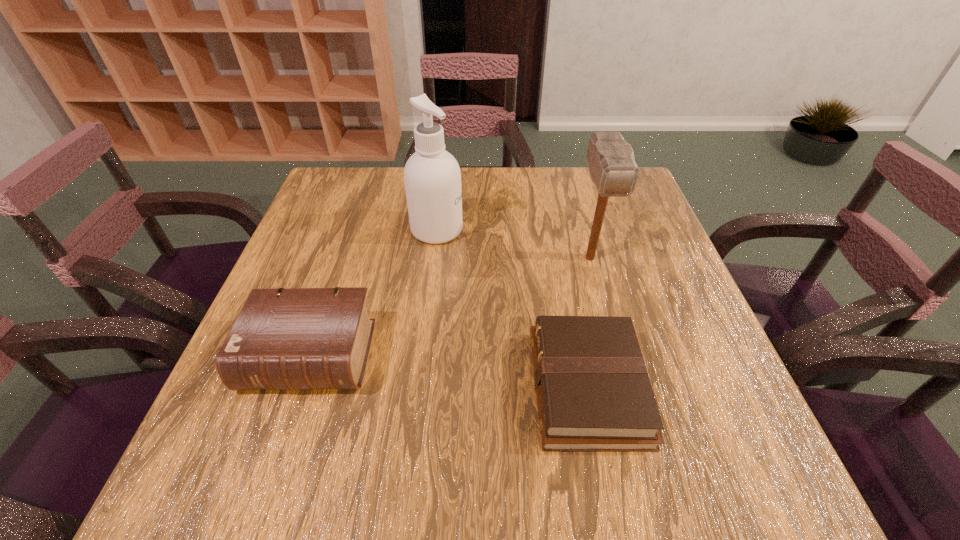
Locate an element on the screen. This screenshot has width=960, height=540. vacant space at the far left corner is located at coordinates (358, 188).

Identify the location of vacant space at the far right corner of the desktop. pyautogui.click(x=612, y=208).

Where is `blank region between the cleansing agent and the shorter Bible`? The image size is (960, 540). blank region between the cleansing agent and the shorter Bible is located at coordinates (512, 308).

The width and height of the screenshot is (960, 540). In order to click on free space between the second shortest object and the mallet in this screenshot , I will do `click(450, 306)`.

Image resolution: width=960 pixels, height=540 pixels. In order to click on empty space that is in between the shorter Bible and the cleansing agent in this screenshot , I will do `click(512, 308)`.

Image resolution: width=960 pixels, height=540 pixels. I want to click on blank region between the left Bible and the mallet, so (450, 306).

Identify the location of free space between the leftmost object and the third object from right to left. (373, 293).

Locate an element on the screen. This screenshot has height=540, width=960. vacant area that lies between the third shortest object and the cleansing agent is located at coordinates (514, 244).

The width and height of the screenshot is (960, 540). I want to click on free space between the shorter Bible and the cleansing agent, so click(x=512, y=308).

Locate an element on the screen. Image resolution: width=960 pixels, height=540 pixels. vacant space that is in between the second shortest object and the cleansing agent is located at coordinates pos(373,293).